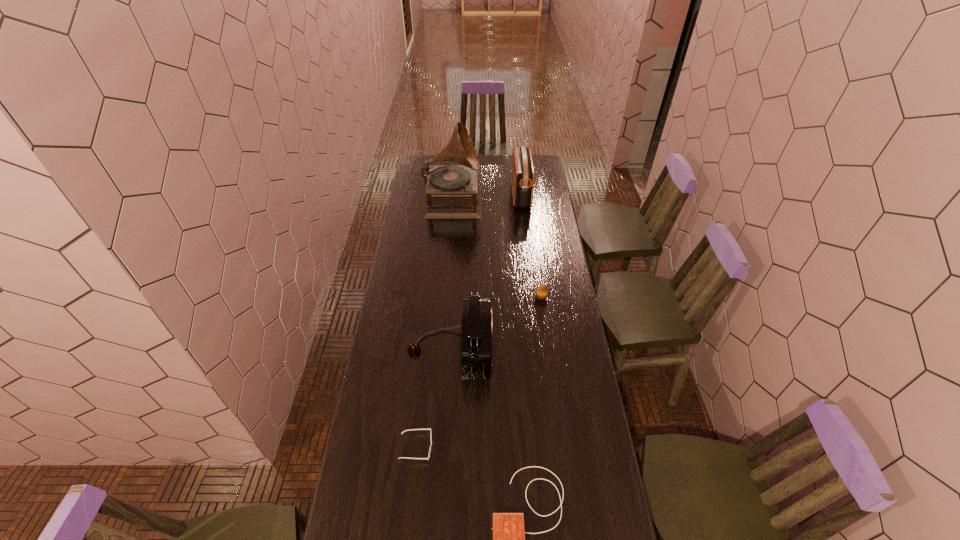
The image size is (960, 540). Find the location of `record player`. record player is located at coordinates (453, 192).

This screenshot has height=540, width=960. I want to click on the farthest radio receiver, so click(x=522, y=174).

Where is `the third nearest object`? Image resolution: width=960 pixels, height=540 pixels. the third nearest object is located at coordinates (476, 325).

The image size is (960, 540). I want to click on pear, so click(x=541, y=293).

Find the location of `sunglasses`. sunglasses is located at coordinates (430, 428).

You are a GUI agent. You are given a task and a screenshot of the screen. Output one action in this format:
    pyautogui.click(x=<x>, y=<y>)
    Task: Click on the second nearest object
    
    Given the screenshot: What is the action you would take?
    pyautogui.click(x=430, y=428)

The width and height of the screenshot is (960, 540). In order to click on free point located from the horn of the tallest object in this screenshot , I will do `click(520, 199)`.

Where is `free region located on the front-facing side of the farthest radio receiver`? Image resolution: width=960 pixels, height=540 pixels. free region located on the front-facing side of the farthest radio receiver is located at coordinates (502, 194).

This screenshot has height=540, width=960. In order to click on vacant region located on the front-facing side of the farthest radio receiver in this screenshot , I will do `click(488, 194)`.

The width and height of the screenshot is (960, 540). What are the coordinates of `free region located on the front-facing side of the farthest radio receiver` in the screenshot? It's located at (447, 194).